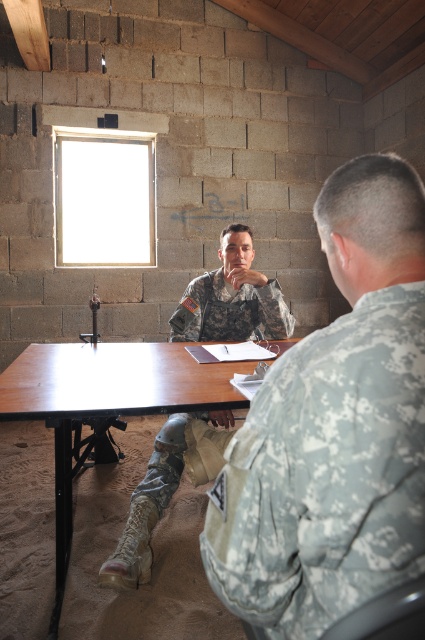
You are a photographer setting up a shoot in this room. You need to place a large tripod in the center of the brown wood table at center without blocking the camouflage fabric uniform at back. Is this possible?

The camouflage fabric uniform at back is positioned over the brown wood table at center, so placing a large tripod in the center would block it. Choose another location for the tripod.

You are a photographer setting up for a group photo in the room. You need to ensure both the camouflage fabric uniform at back and the camouflage uniform at center are visible in the frame. Which uniform should you position closer to the front to avoid being cut off?

The camouflage fabric uniform at back is shorter than the camouflage uniform at center. To ensure both are visible, position the camouflage fabric uniform at back closer to the front since it is shorter and might be obscured by the taller camouflage uniform at center.